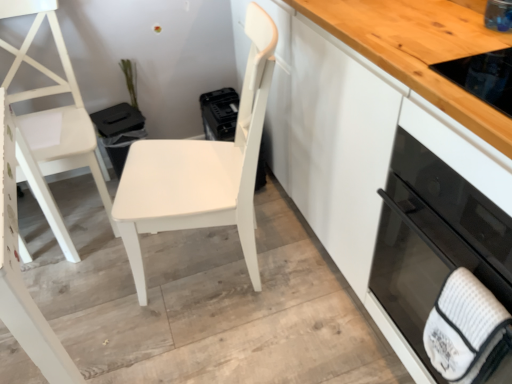
I want to click on free space in front of white matte chair at center, the second chair from the left, so click(215, 339).